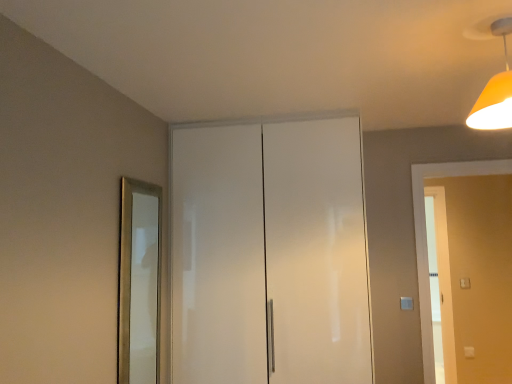
Question: Are white glossy cabinet at center and gold metallic mirror at left located far from each other?

Choices:
 (A) no
 (B) yes

Answer: (A)

Question: Would you say white glossy cabinet at center is outside gold metallic mirror at left?

Choices:
 (A) no
 (B) yes

Answer: (B)

Question: Considering the relative positions of white glossy cabinet at center and gold metallic mirror at left in the image provided, is white glossy cabinet at center to the right of gold metallic mirror at left from the viewer's perspective?

Choices:
 (A) yes
 (B) no

Answer: (A)

Question: Is white glossy cabinet at center bigger than gold metallic mirror at left?

Choices:
 (A) no
 (B) yes

Answer: (B)

Question: Can you confirm if white glossy cabinet at center is wider than gold metallic mirror at left?

Choices:
 (A) no
 (B) yes

Answer: (B)

Question: From the image's perspective, would you say white glossy cabinet at center is positioned over gold metallic mirror at left?

Choices:
 (A) yes
 (B) no

Answer: (A)

Question: Does orange matte light fixture at upper right lie in front of gold metallic mirror at left?

Choices:
 (A) no
 (B) yes

Answer: (B)

Question: Can you confirm if orange matte light fixture at upper right is positioned to the left of gold metallic mirror at left?

Choices:
 (A) yes
 (B) no

Answer: (B)

Question: Does orange matte light fixture at upper right appear on the right side of gold metallic mirror at left?

Choices:
 (A) yes
 (B) no

Answer: (A)

Question: Is orange matte light fixture at upper right placed right next to gold metallic mirror at left?

Choices:
 (A) yes
 (B) no

Answer: (B)

Question: Is orange matte light fixture at upper right outside gold metallic mirror at left?

Choices:
 (A) yes
 (B) no

Answer: (A)

Question: Is gold metallic mirror at left a part of orange matte light fixture at upper right?

Choices:
 (A) yes
 (B) no

Answer: (B)

Question: From the image's perspective, is white glossy cabinet at center beneath white glossy door at right?

Choices:
 (A) no
 (B) yes

Answer: (A)